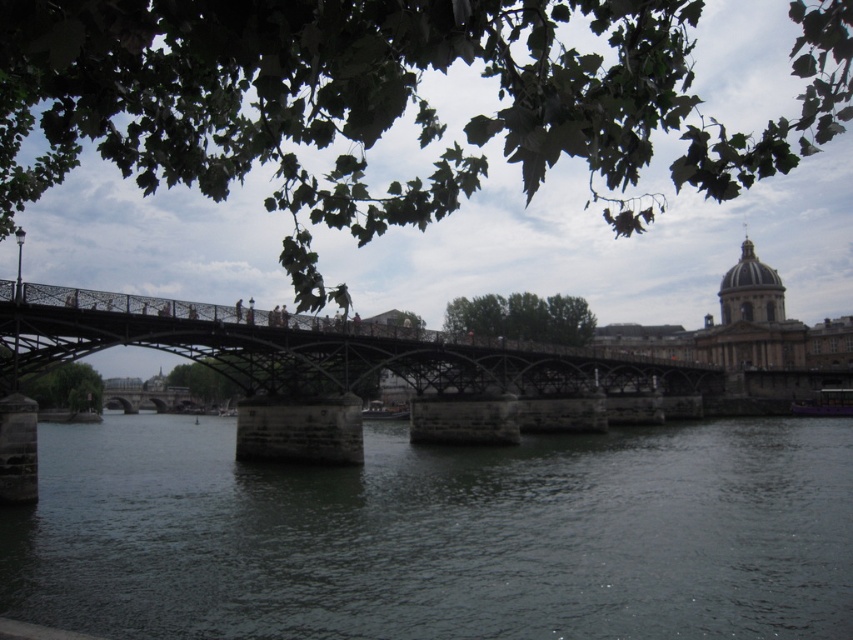
You are standing on the riverside path and want to take a photo of the dark gray water at center and the green wrought iron bridge at center. Which object will appear larger in your photo?

The dark gray water at center will appear larger in the photo because it is closer to the viewer than the green wrought iron bridge at center.